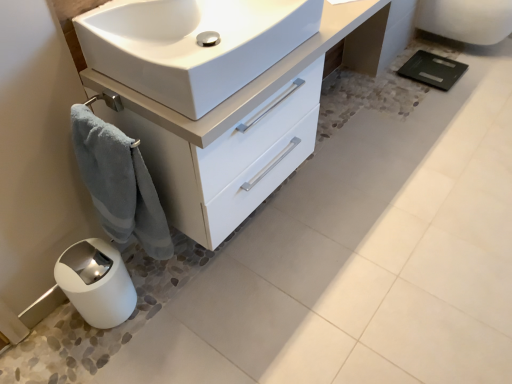
What do you see at coordinates (96, 282) in the screenshot? This screenshot has height=384, width=512. I see `white glossy trash can at lower left` at bounding box center [96, 282].

What are the coordinates of `white glossy sink at center` in the screenshot? It's located at (192, 45).

Where is `white glossy cabinet at lower left`? The height and width of the screenshot is (384, 512). white glossy cabinet at lower left is located at coordinates (243, 127).

Could you tell me if blue plush towel at lower left is turned towards white glossy trash can at lower left?

No, blue plush towel at lower left is not oriented towards white glossy trash can at lower left.

Can you confirm if blue plush towel at lower left is wider than white glossy trash can at lower left?

No.

From a real-world perspective, between blue plush towel at lower left and white glossy trash can at lower left, who is vertically lower?

From a 3D spatial view, white glossy trash can at lower left is below.

Would you consider blue plush towel at lower left to be distant from white glossy trash can at lower left?

No.

Which is nearer, (285, 17) or (135, 217)?

Point (285, 17)

Looking at the image, does white glossy sink at center seem bigger or smaller compared to blue plush towel at lower left?

Clearly, white glossy sink at center is larger in size than blue plush towel at lower left.

Is white glossy sink at center positioned behind blue plush towel at lower left?

No, it is not.

Is white glossy porcelain at upper right facing towards blue plush towel at lower left?

No, white glossy porcelain at upper right is not aimed at blue plush towel at lower left.

From the picture: Considering the relative sizes of white glossy porcelain at upper right and blue plush towel at lower left in the image provided, is white glossy porcelain at upper right wider than blue plush towel at lower left?

Yes, white glossy porcelain at upper right is wider than blue plush towel at lower left.

I want to click on bath towel on the left side of white glossy porcelain at upper right, so click(119, 184).

Considering the relative sizes of white glossy porcelain at upper right and blue plush towel at lower left in the image provided, is white glossy porcelain at upper right smaller than blue plush towel at lower left?

Incorrect, white glossy porcelain at upper right is not smaller in size than blue plush towel at lower left.

Between white glossy sink at center and white glossy cabinet at lower left, which one has smaller size?

Smaller between the two is white glossy sink at center.

Does white glossy sink at center have a greater height compared to white glossy cabinet at lower left?

No, white glossy sink at center is not taller than white glossy cabinet at lower left.

In order to click on sink located in front of the white glossy cabinet at lower left in this screenshot , I will do `click(192, 45)`.

Is white glossy sink at center facing away from white glossy cabinet at lower left?

No, white glossy sink at center is not facing the opposite direction of white glossy cabinet at lower left.

Is blue plush towel at lower left positioned behind white glossy cabinet at lower left?

No, blue plush towel at lower left is in front of white glossy cabinet at lower left.

Between blue plush towel at lower left and white glossy cabinet at lower left, which one has larger width?

With larger width is white glossy cabinet at lower left.

Which is nearer, [117,200] or [379,50]?

Clearly, point [117,200] is closer to the camera than point [379,50].

Who is taller, blue plush towel at lower left or white glossy cabinet at lower left?

Standing taller between the two is blue plush towel at lower left.

How different are the orientations of white glossy cabinet at lower left and white glossy sink at center in degrees?

The angular difference between white glossy cabinet at lower left and white glossy sink at center is 0.00149 degrees.

Is white glossy cabinet at lower left positioned with its back to white glossy sink at center?

No, white glossy cabinet at lower left's orientation is not away from white glossy sink at center.

Is white glossy cabinet at lower left directly adjacent to white glossy sink at center?

white glossy cabinet at lower left is not next to white glossy sink at center, and they're not touching.

In the image, is white glossy cabinet at lower left positioned in front of or behind white glossy sink at center?

In the image, white glossy cabinet at lower left appears behind white glossy sink at center.

From the picture: Can you confirm if white glossy trash can at lower left is wider than blue plush towel at lower left?

Yes, white glossy trash can at lower left is wider than blue plush towel at lower left.

Is white glossy trash can at lower left looking in the opposite direction of blue plush towel at lower left?

No, white glossy trash can at lower left is not facing the opposite direction of blue plush towel at lower left.

From the picture: From the image's perspective, does white glossy trash can at lower left appear higher than blue plush towel at lower left?

No.

Considering the relative positions of white glossy trash can at lower left and blue plush towel at lower left in the image provided, is white glossy trash can at lower left to the right of blue plush towel at lower left from the viewer's perspective?

In fact, white glossy trash can at lower left is to the left of blue plush towel at lower left.

This screenshot has height=384, width=512. Find the location of `bath towel above the white glossy trash can at lower left (from a real-world perspective)`. bath towel above the white glossy trash can at lower left (from a real-world perspective) is located at coordinates (119, 184).

Locate an element on the screen. The width and height of the screenshot is (512, 384). bath towel behind the white glossy sink at center is located at coordinates (119, 184).

Looking at the image, which one is located closer to blue plush towel at lower left, white glossy porcelain at upper right or white glossy cabinet at lower left?

Among the two, white glossy cabinet at lower left is located nearer to blue plush towel at lower left.

Looking at this image, when comparing their distances from blue plush towel at lower left, does white glossy cabinet at lower left or white glossy porcelain at upper right seem closer?

white glossy cabinet at lower left is closer to blue plush towel at lower left.

Estimate the real-world distances between objects in this image. Which object is further from white glossy trash can at lower left, blue plush towel at lower left or white glossy sink at center?

white glossy sink at center.

Estimate the real-world distances between objects in this image. Which object is closer to white glossy sink at center, blue plush towel at lower left or white glossy cabinet at lower left?

Among the two, white glossy cabinet at lower left is located nearer to white glossy sink at center.

Estimate the real-world distances between objects in this image. Which object is further from blue plush towel at lower left, white glossy sink at center or white glossy cabinet at lower left?

Among the two, white glossy sink at center is located further to blue plush towel at lower left.

Estimate the real-world distances between objects in this image. Which object is closer to white glossy porcelain at upper right, white glossy sink at center or white glossy cabinet at lower left?

white glossy cabinet at lower left.

Which object lies nearer to the anchor point white glossy porcelain at upper right, blue plush towel at lower left or white glossy sink at center?

white glossy sink at center lies closer to white glossy porcelain at upper right than the other object.

Which object lies nearer to the anchor point white glossy porcelain at upper right, white glossy cabinet at lower left or blue plush towel at lower left?

Based on the image, white glossy cabinet at lower left appears to be nearer to white glossy porcelain at upper right.

Where is `bath towel between white glossy sink at center and white glossy trash can at lower left in the up-down direction`? The width and height of the screenshot is (512, 384). bath towel between white glossy sink at center and white glossy trash can at lower left in the up-down direction is located at coordinates (119, 184).

Where is `sink situated between blue plush towel at lower left and white glossy porcelain at upper right from left to right`? sink situated between blue plush towel at lower left and white glossy porcelain at upper right from left to right is located at coordinates (192, 45).

I want to click on bathroom cabinet between white glossy trash can at lower left and white glossy porcelain at upper right from left to right, so click(243, 127).

This screenshot has height=384, width=512. What are the coordinates of `bathroom cabinet located between white glossy sink at center and white glossy porcelain at upper right in the left-right direction` in the screenshot? It's located at (243, 127).